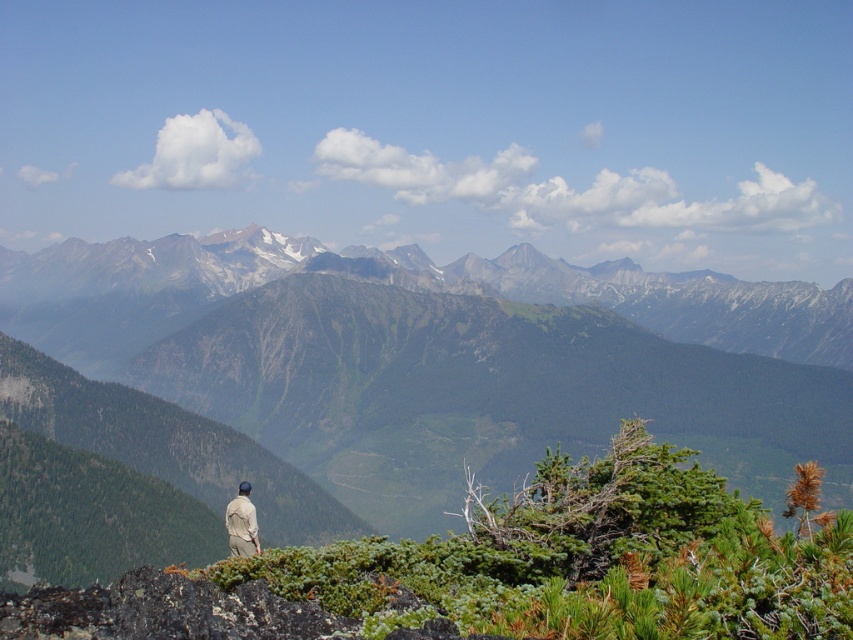
You are a hiker planning to cross the green grassy mountain range at center and the tan fabric jacket at lower left. Which one has a greater width?

The green grassy mountain range at center has a greater width than the tan fabric jacket at lower left.

You are a hiker planning to set up a tent at point (395, 285). According to the image, what terrain feature will you find there?

At point (395, 285) lies green rocky mountains at center.

Based on the scene description, what does the point at coordinates (445, 356) represent?

The point at coordinates (445, 356) represents the green grassy mountain range at center.